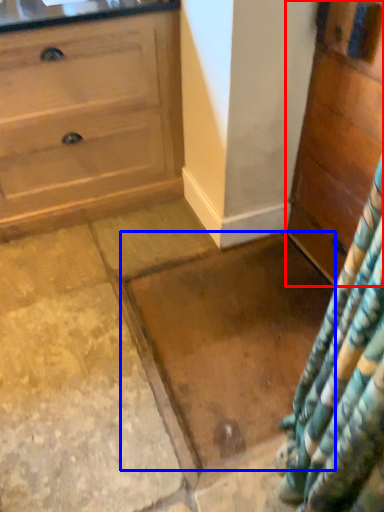
Question: Among these objects, which one is farthest to the camera, chest of drawers (highlighted by a red box) or granite (highlighted by a blue box)?

Choices:
 (A) chest of drawers
 (B) granite

Answer: (B)